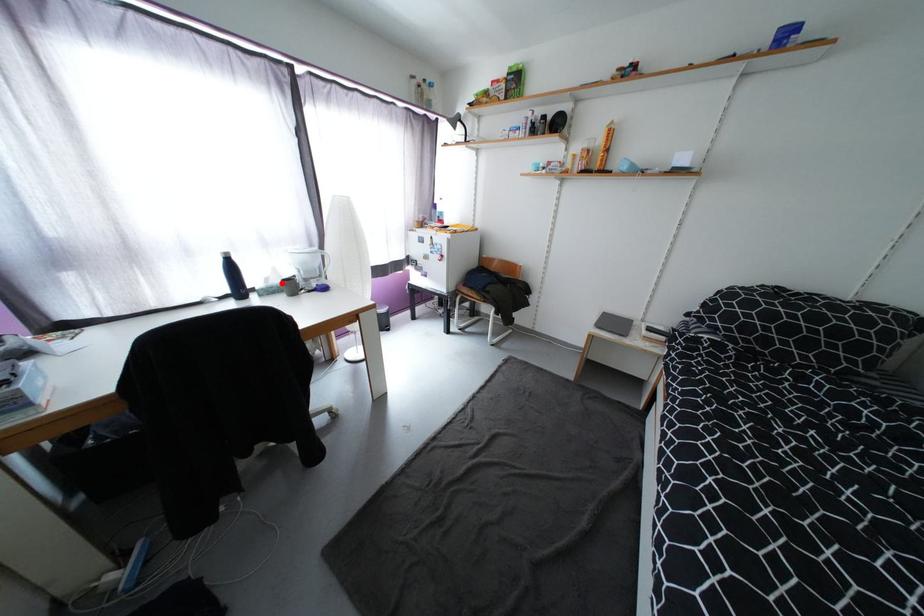
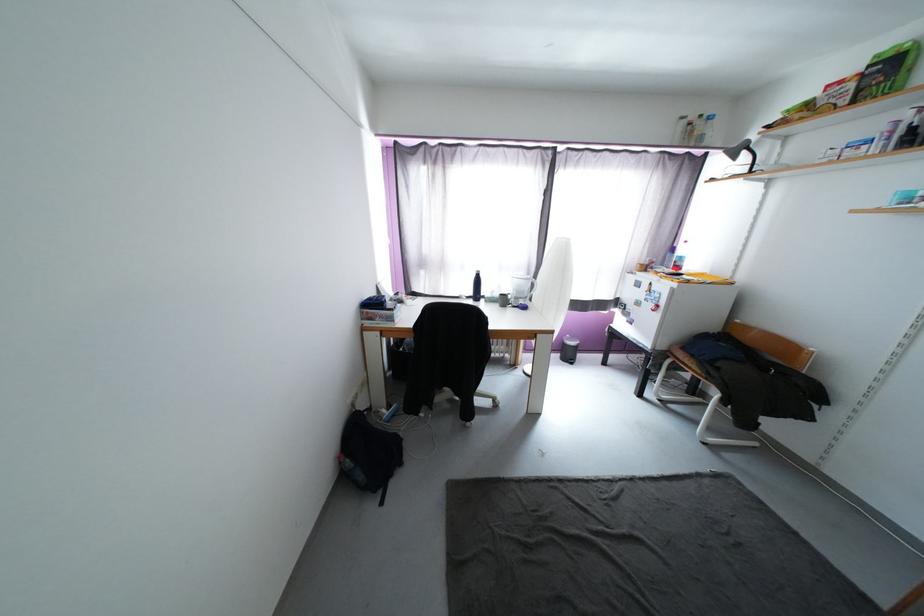
In the second image, find the point that corresponds to the highlighted location in the first image.

(503, 296)